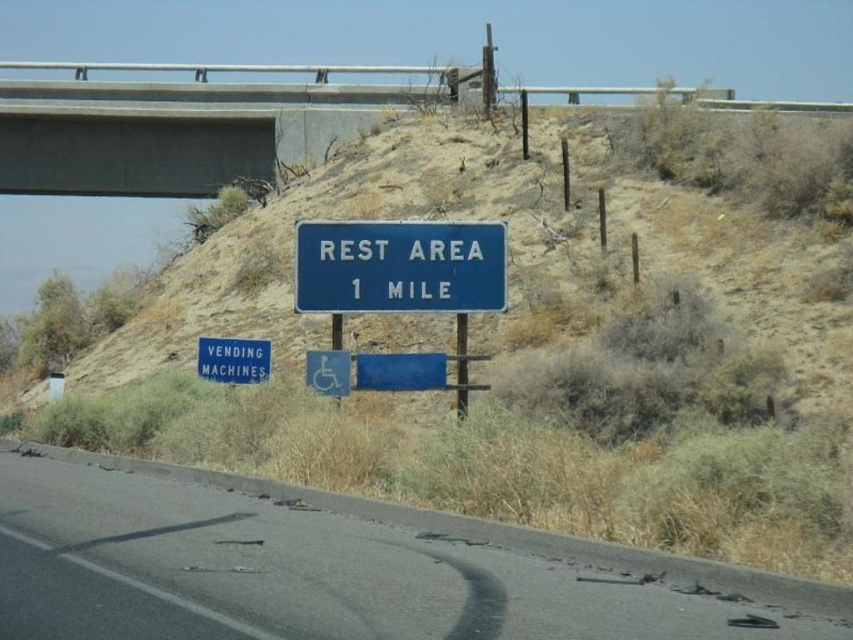
You are a delivery driver who needs to park your truck near the blue metallic vending machines at lower left. The truck is 1.5 meters tall. Can you safely drive under the concrete at upper center without hitting it?

The concrete at upper center is much taller than the blue metallic vending machines at lower left, so yes, the truck can safely drive under the concrete at upper center since it is taller than the truck.

You are a delivery driver approaching the rest area. You need to park near the blue metallic vending machines at lower left. As you drive along the black asphalt road at lower center, on which side should you turn to reach the vending machines?

The black asphalt road at lower center is to the right of the blue metallic vending machines at lower left, so you should turn left to reach them.

You are a delivery driver who needs to park your truck near the blue metallic vending machines at lower left. Your truck is 20 feet long. If you are currently on the black asphalt road at lower center, can you safely maneuver your truck to park next to the vending machines without hitting any obstacles?

The black asphalt road at lower center is 25.28 feet away from the blue metallic vending machines at lower left. Since your truck is 20 feet long, there is enough space to maneuver safely as the distance between them allows for parking without obstruction.